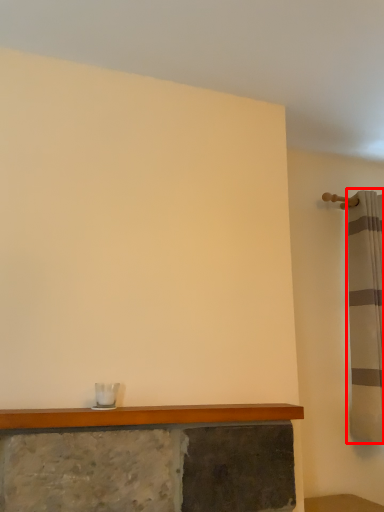
Question: In this image, where is shower curtain (annotated by the red box) located relative to counter top?

Choices:
 (A) right
 (B) left

Answer: (A)